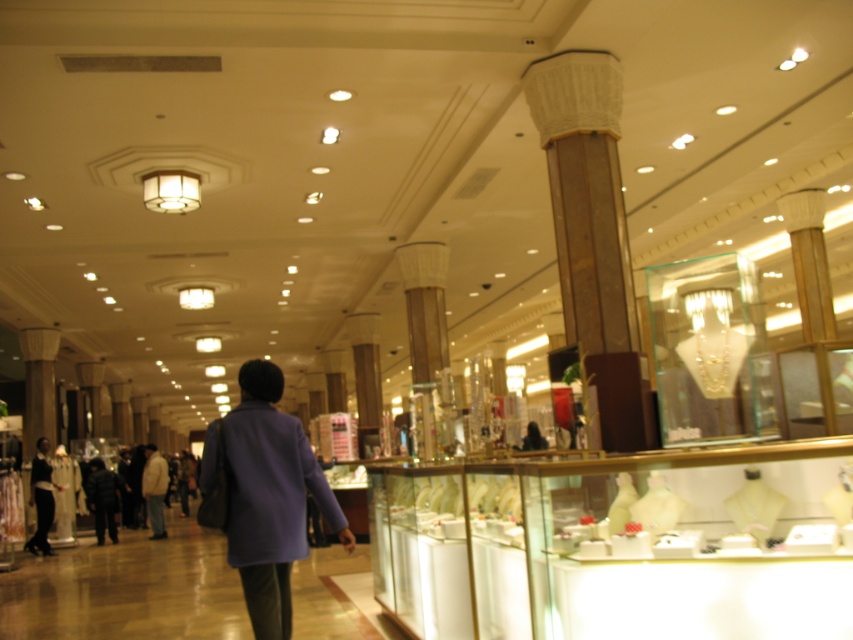
Consider the image. You are a salesperson in the mall and see a customer wearing a dark blue coat at center and a light beige jacket at center. Which customer is more to the left side?

The dark blue coat at center is more to the left side because it is positioned on the left side of the light beige jacket at center.

You are a store clerk who needs to hang both the purple fabric coat at center and the light beige jacket at center on a narrow rack. Which one should you hang first to save space?

The purple fabric coat at center is thinner than the light beige jacket at center, so you should hang the light beige jacket at center first to save space.